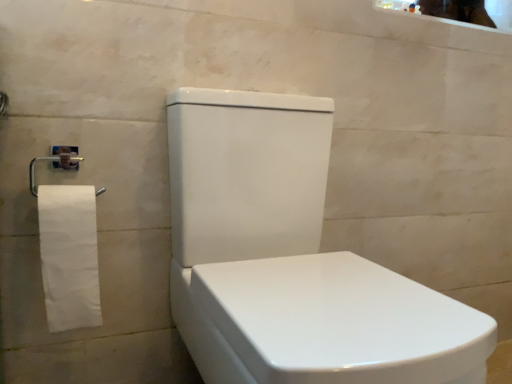
Question: Is white matte toilet paper at left facing towards white glossy toilet at center?

Choices:
 (A) yes
 (B) no

Answer: (B)

Question: Is white matte toilet paper at left placed right next to white glossy toilet at center?

Choices:
 (A) no
 (B) yes

Answer: (A)

Question: From a real-world perspective, is white matte toilet paper at left over white glossy toilet at center?

Choices:
 (A) no
 (B) yes

Answer: (B)

Question: From the image's perspective, does white matte toilet paper at left appear higher than white glossy toilet at center?

Choices:
 (A) no
 (B) yes

Answer: (B)

Question: Does white matte toilet paper at left have a larger size compared to white glossy toilet at center?

Choices:
 (A) yes
 (B) no

Answer: (B)

Question: From the image's perspective, is white glossy toilet at center positioned above or below white matte toilet paper at left?

Choices:
 (A) below
 (B) above

Answer: (A)

Question: Is white glossy toilet at center to the left or to the right of white matte toilet paper at left in the image?

Choices:
 (A) right
 (B) left

Answer: (A)

Question: In terms of height, does white glossy toilet at center look taller or shorter compared to white matte toilet paper at left?

Choices:
 (A) short
 (B) tall

Answer: (B)

Question: Looking at their shapes, would you say white glossy toilet at center is wider or thinner than white matte toilet paper at left?

Choices:
 (A) thin
 (B) wide

Answer: (B)

Question: Is white glossy toilet at center wider or thinner than glossy ceramic mirror at upper right?

Choices:
 (A) thin
 (B) wide

Answer: (B)

Question: In the image, is white glossy toilet at center positioned in front of or behind glossy ceramic mirror at upper right?

Choices:
 (A) behind
 (B) front

Answer: (B)

Question: Looking at the image, does white glossy toilet at center seem bigger or smaller compared to glossy ceramic mirror at upper right?

Choices:
 (A) small
 (B) big

Answer: (B)

Question: Is point (338, 256) positioned closer to the camera than point (478, 6)?

Choices:
 (A) closer
 (B) farther

Answer: (A)

Question: From the image's perspective, relative to white glossy toilet at center, is white matte toilet paper at left above or below?

Choices:
 (A) below
 (B) above

Answer: (B)

Question: From their relative heights in the image, would you say white matte toilet paper at left is taller or shorter than white glossy toilet at center?

Choices:
 (A) tall
 (B) short

Answer: (B)